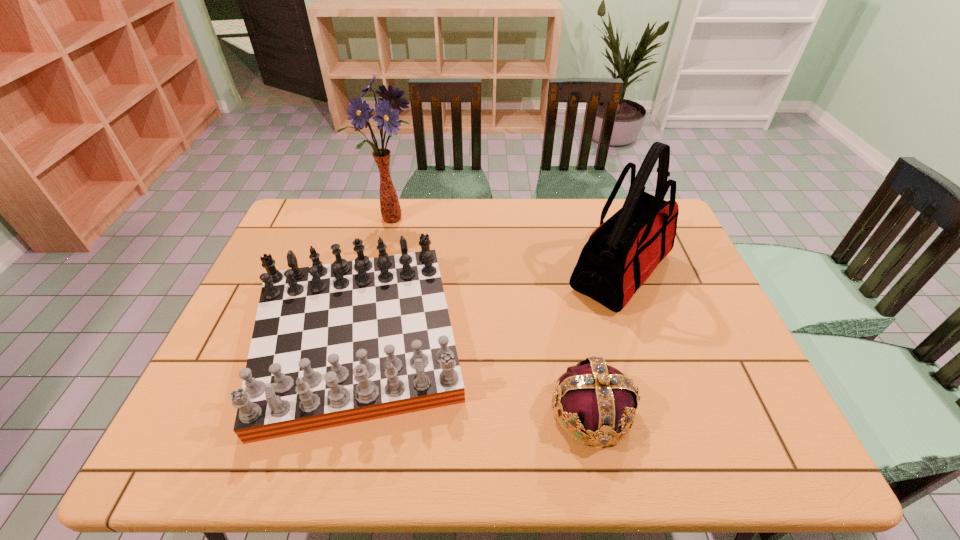
The width and height of the screenshot is (960, 540). In order to click on gameboard located at the near edge in this screenshot , I will do (334, 344).

I want to click on crown positioned at the near edge, so click(x=595, y=398).

Where is `object present at the left edge`? This screenshot has width=960, height=540. object present at the left edge is located at coordinates (334, 344).

Where is `object that is at the right edge`? object that is at the right edge is located at coordinates pos(619,256).

In order to click on object at the near left corner in this screenshot , I will do `click(334, 344)`.

I want to click on object at the far right corner, so click(x=619, y=256).

I want to click on blank space at the far edge, so click(343, 217).

Locate an element on the screen. free space at the near edge of the desktop is located at coordinates (380, 436).

Where is `vacant space at the right edge of the desktop`? The height and width of the screenshot is (540, 960). vacant space at the right edge of the desktop is located at coordinates (736, 381).

Identify the location of free space at the near left corner of the desktop. (215, 442).